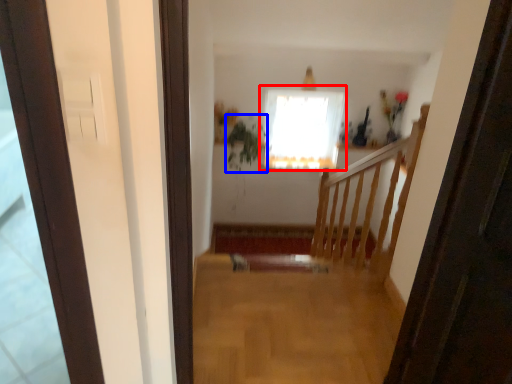
Question: Which object is further to the camera taking this photo, window (highlighted by a red box) or plant (highlighted by a blue box)?

Choices:
 (A) window
 (B) plant

Answer: (A)